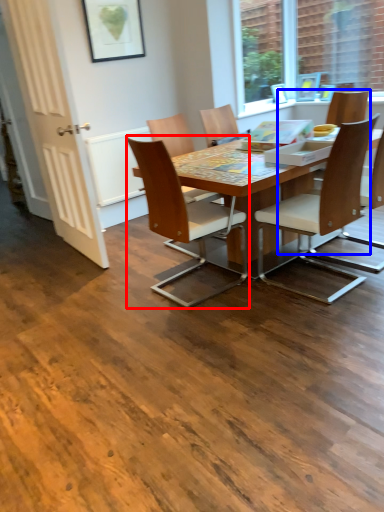
Question: Which of the following is the closest to the observer, chair (highlighted by a red box) or chair (highlighted by a blue box)?

Choices:
 (A) chair
 (B) chair

Answer: (A)